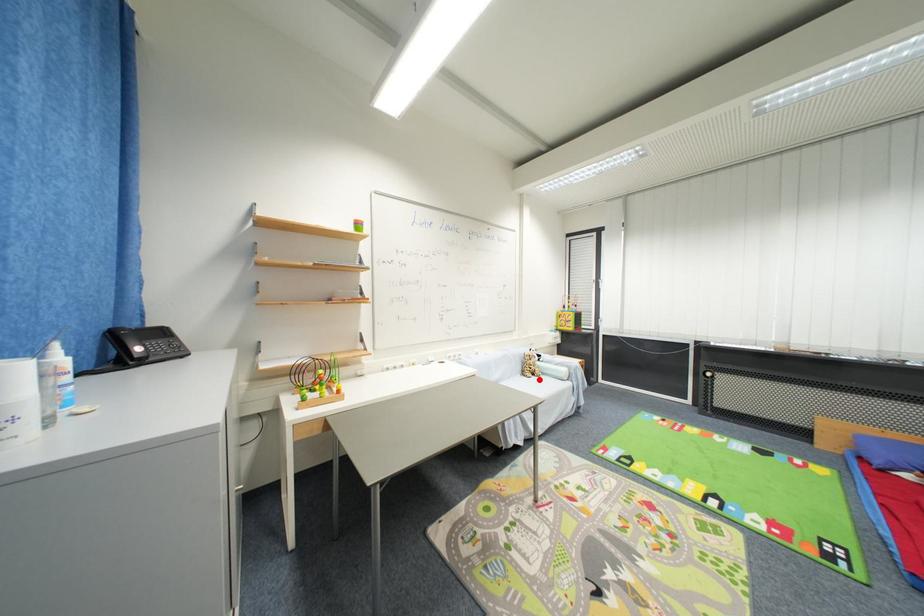
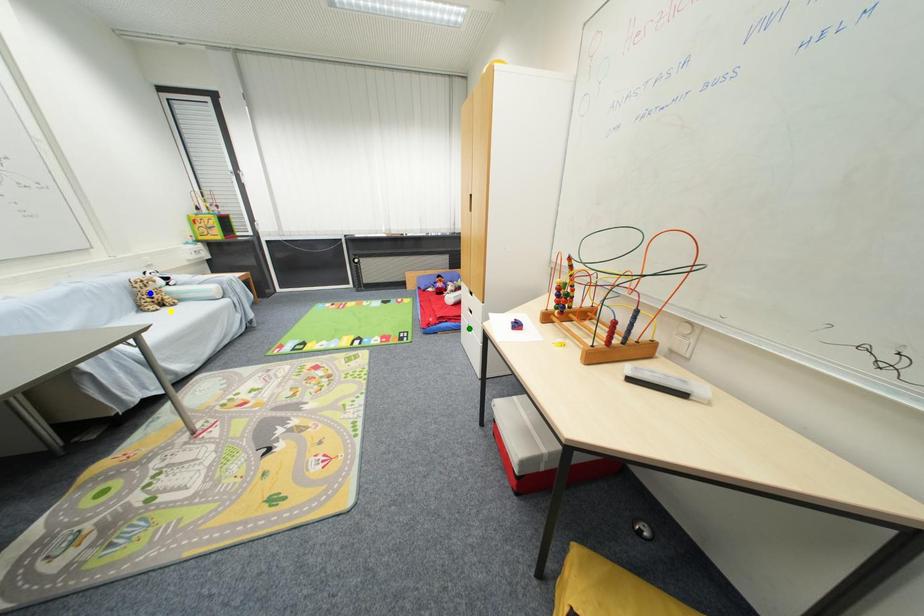
Question: I am providing you with two images of the same scene from different viewpoints. A red point is marked on the first image. You are given multiple points on the second image. Which point in image 2 represents the same 3d spot as the red point in image 1?

Choices:
 (A) blue point
 (B) green point
 (C) yellow point

Answer: (C)